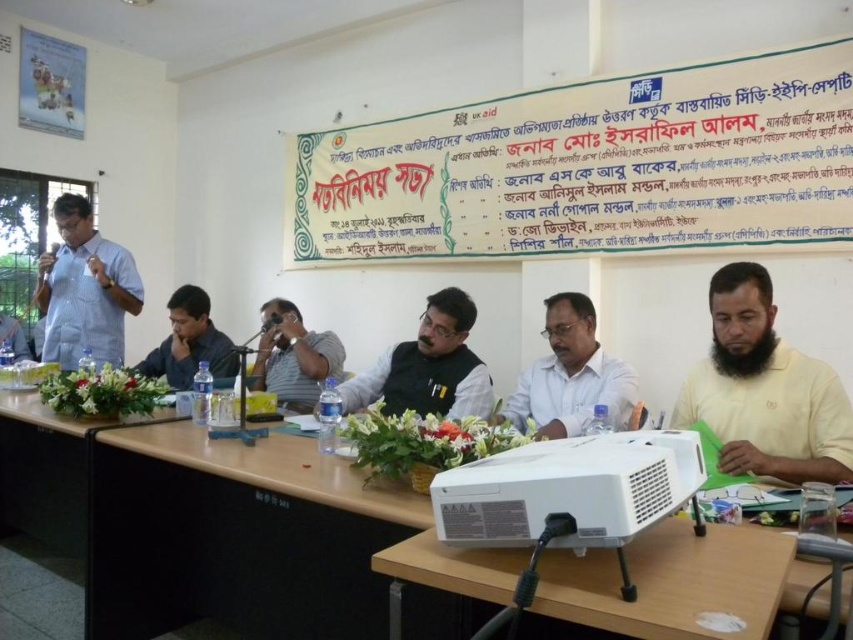
You are attending a meeting and need to locate the white plastic projector at lower center and the white checkered shirt at left. From the perspective of someone sitting at the table, which object is closer to the right side of the room?

The white plastic projector at lower center is closer to the right side of the room because it is positioned to the right of the white checkered shirt at left.